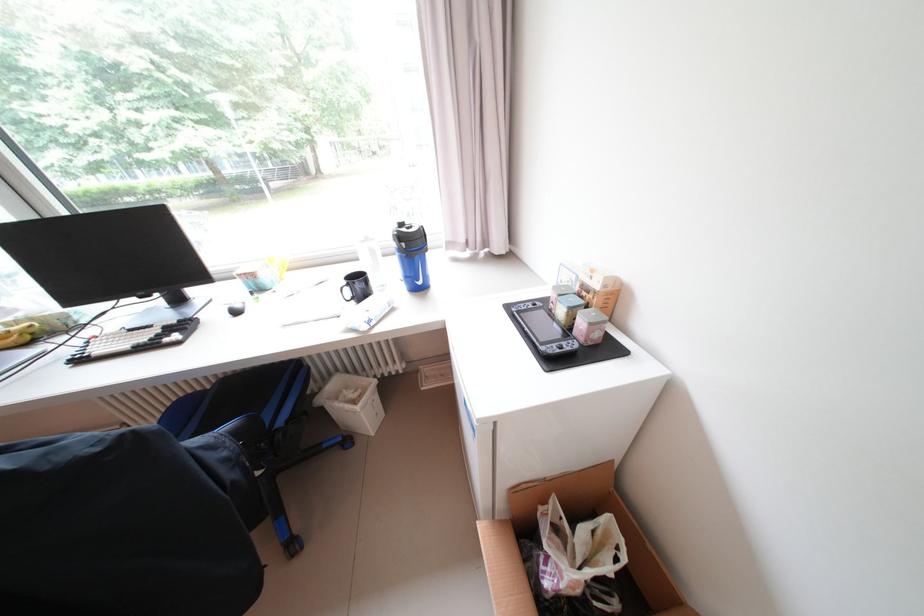
The width and height of the screenshot is (924, 616). What are the coordinates of `white trash can` in the screenshot? It's located at (351, 403).